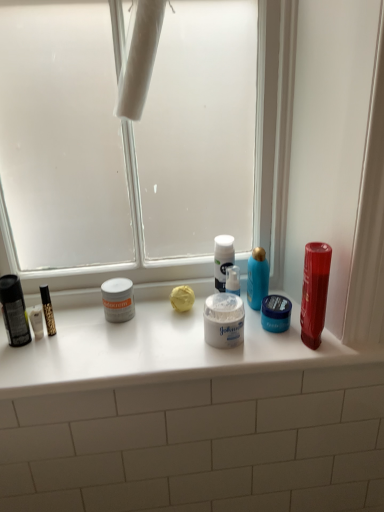
I want to click on free space to the left of shiny plastic mouthwash at right, so click(x=260, y=350).